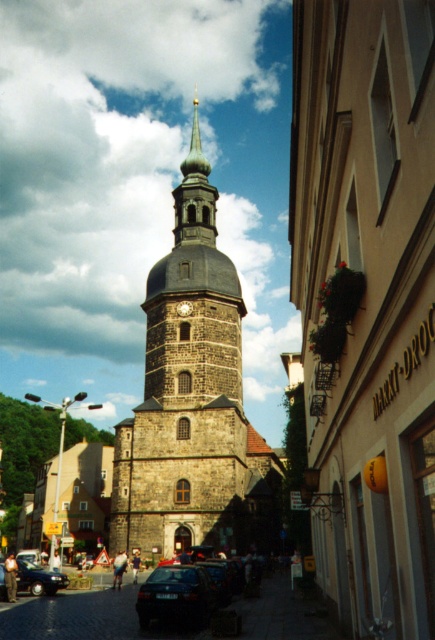
You are a delivery driver who needs to park your dark blue matte car at lower center near the dark gray stone clock at center. Considering the size of the car, will there be enough space to park it without blocking the entrance to the clock tower?

The dark blue matte car at lower center is larger in size than the dark gray stone clock at center. Therefore, there might not be enough space to park the car without blocking the entrance to the clock tower.

You are a photographer standing on the street and want to capture both the brown stone church at center and the dark blue matte car at lower center in a single shot. However, your camera has a limited field of view. Based on their widths, which object should you position closer to the center of the frame to ensure both fit within the shot?

The brown stone church at center is thinner than the dark blue matte car at lower center, so positioning the car closer to the center of the frame would allow both objects to fit within the shot since the car is wider and requires more space.

You are a tourist standing in front of the historic stone tower and want to take a photo that includes the entire structure. The camera you have can focus on objects up to 30 meters away. Will the brown stone church at center be in focus?

The brown stone church at center is 32.85 meters away from the camera, which is beyond the camera focus limit of 30 meters. Therefore, the church will not be in focus.